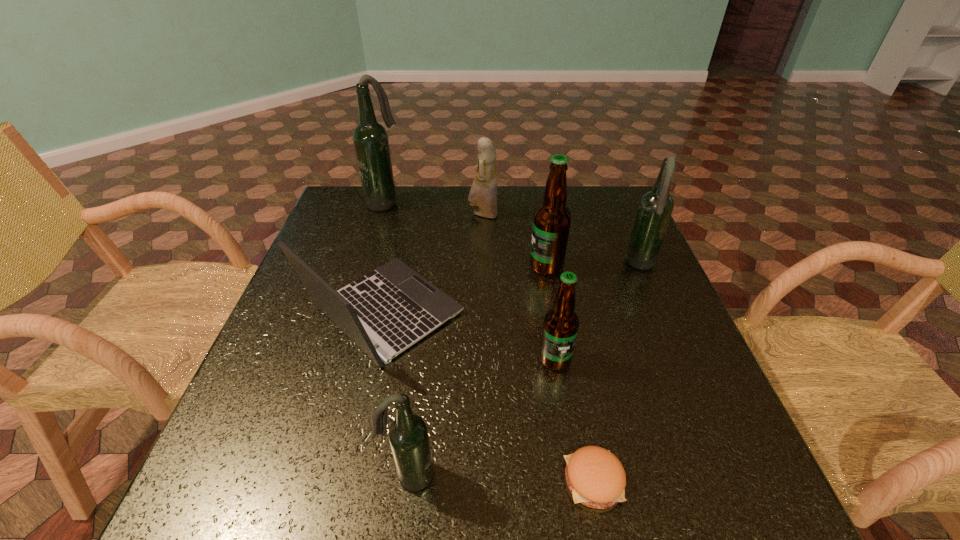
Locate an element on the screen. This screenshot has width=960, height=540. vacant space situated 0.390m on the right of the nearest dark beer bottle is located at coordinates (672, 475).

Identify the location of blank space located on the label of the nearer brown beer bottle. (563, 408).

Identify the location of free point located at the front screen of the laptop_computer. (640, 313).

Locate an element on the screen. This screenshot has width=960, height=540. vacant space located on the left of the patty is located at coordinates (441, 481).

This screenshot has height=540, width=960. I want to click on beer bottle that is positioned at the far edge, so coord(370,138).

The width and height of the screenshot is (960, 540). Find the location of `figurine at the far edge`. figurine at the far edge is located at coordinates (x=483, y=193).

Image resolution: width=960 pixels, height=540 pixels. Identify the location of beer bottle that is at the near edge. (408, 436).

Find the location of a particular element. patty located in the near edge section of the desktop is located at coordinates (596, 478).

The width and height of the screenshot is (960, 540). I want to click on beer bottle that is at the left edge, so click(x=370, y=138).

Locate an element on the screen. laptop_computer situated at the left edge is located at coordinates (393, 307).